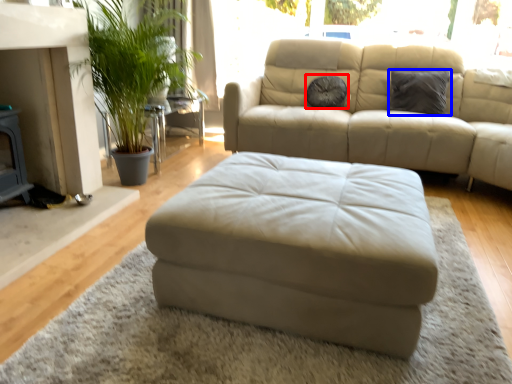
Question: Which object appears farthest to the camera in this image, pillow (highlighted by a red box) or pillow (highlighted by a blue box)?

Choices:
 (A) pillow
 (B) pillow

Answer: (A)